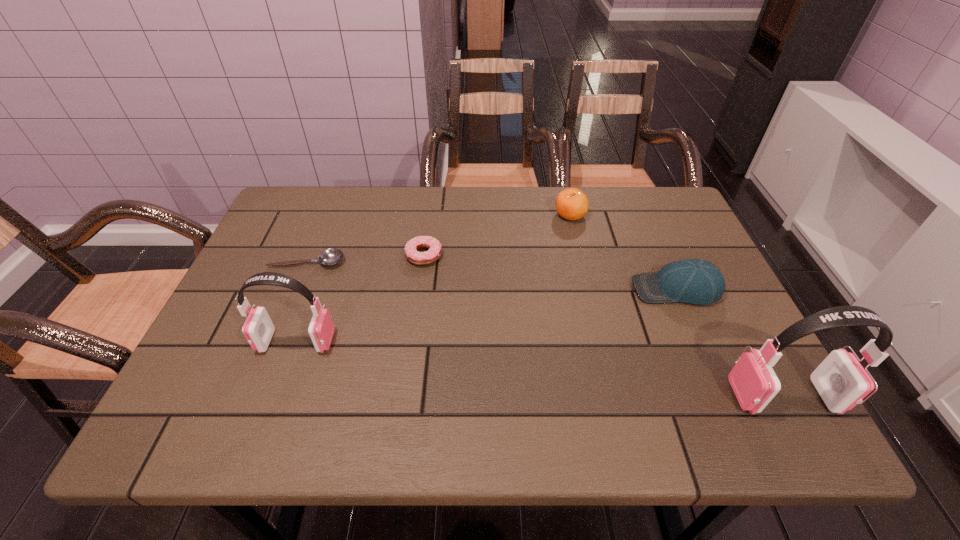
Locate an element on the screen. This screenshot has width=960, height=540. baseball cap located in the right edge section of the desktop is located at coordinates (694, 281).

Identify the location of object situated at the near right corner. The width and height of the screenshot is (960, 540). (841, 381).

This screenshot has height=540, width=960. In the image, there is a desktop. In order to click on free space at the far edge in this screenshot , I will do `click(415, 188)`.

Where is `vacant space at the near edge`? vacant space at the near edge is located at coordinates (476, 375).

Identify the location of vacant space at the left edge. The height and width of the screenshot is (540, 960). (292, 250).

This screenshot has width=960, height=540. In the image, there is a desktop. Identify the location of vacant region at the right edge. pyautogui.click(x=730, y=357).

This screenshot has width=960, height=540. I want to click on vacant space at the far left corner of the desktop, so click(299, 220).

This screenshot has height=540, width=960. Find the location of `free point at the near left corner`. free point at the near left corner is located at coordinates (200, 390).

The height and width of the screenshot is (540, 960). Find the location of `vacant space at the far right corner of the desktop`. vacant space at the far right corner of the desktop is located at coordinates (643, 188).

Find the location of a particular element. This screenshot has height=540, width=960. vacant region between the baseball cap and the third object from right to left is located at coordinates (623, 252).